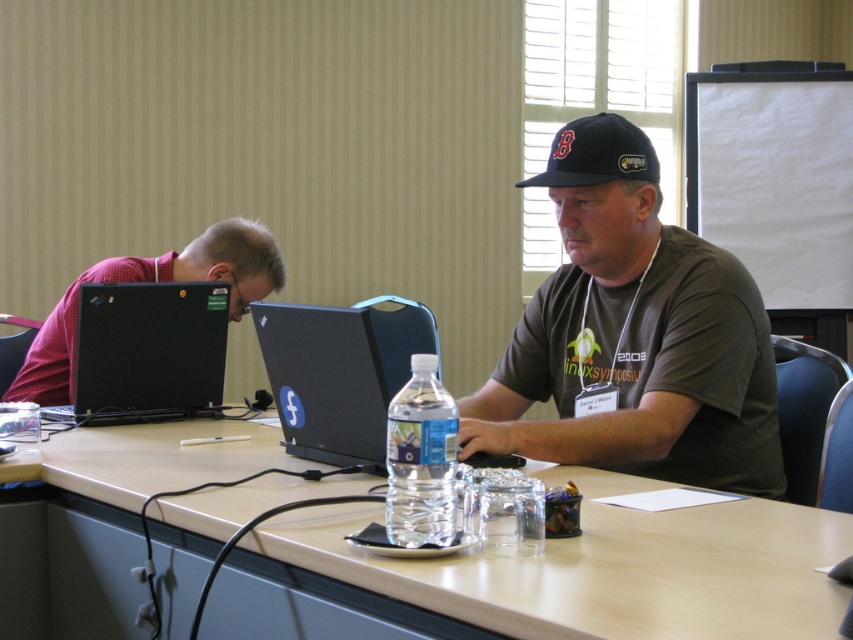
You are standing in front of the table where the two people are sitting. You want to place a small object on the table. Which of the two points, point (767, 602) or point (746, 278), is closer to you?

Point (767, 602) is closer to the viewer than point (746, 278), so you should place the object there if you want it closer to you.